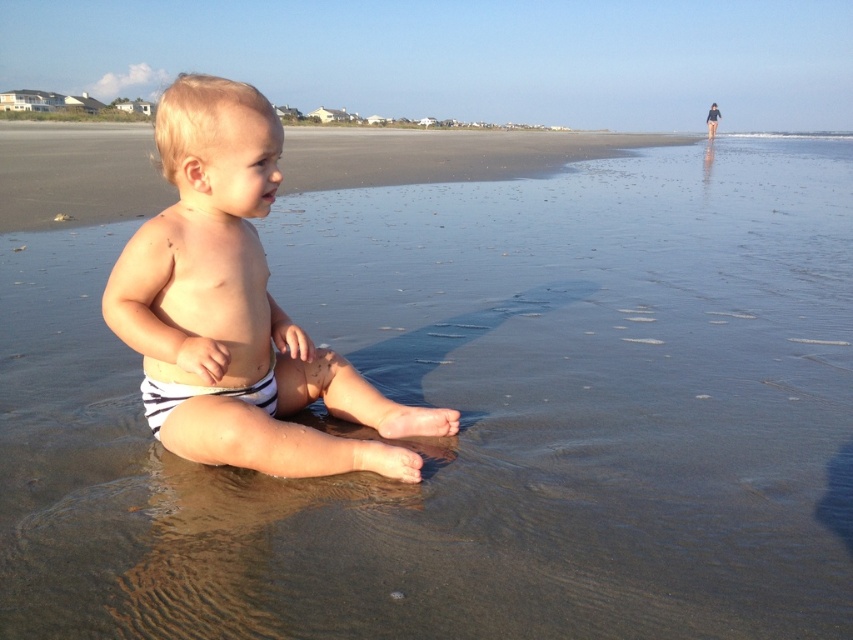
Measure the distance between striped fabric diaper at center and camera.

The distance of striped fabric diaper at center from camera is 5.22 feet.

Where is `striped fabric diaper at center`? The height and width of the screenshot is (640, 853). striped fabric diaper at center is located at coordinates (236, 308).